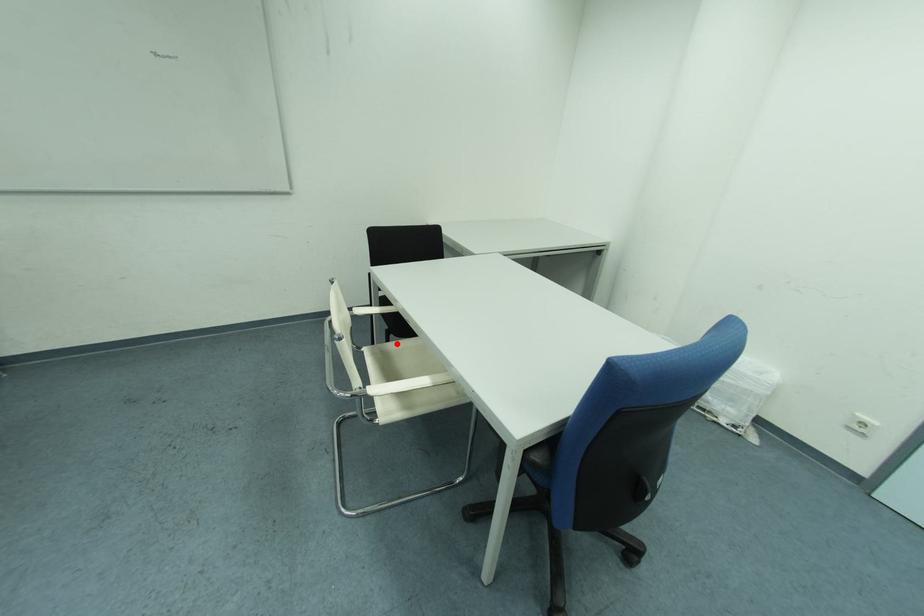
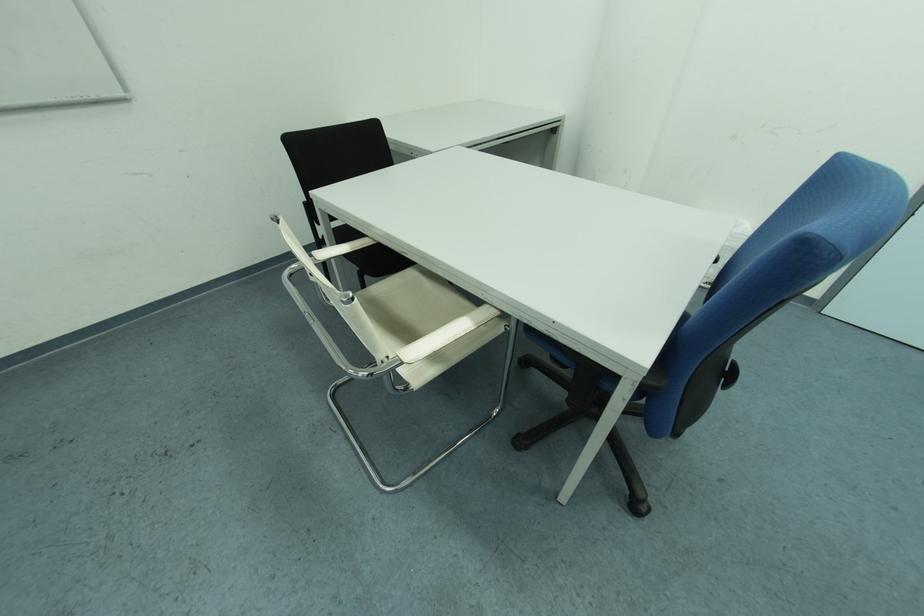
Question: A red point is marked in image1. In image2, is the corresponding 3D point closer to the camera or farther? Reply with the corresponding letter.

Choices:
 (A) The corresponding 3D point is closer.
 (B) The corresponding 3D point is farther.

Answer: (A)